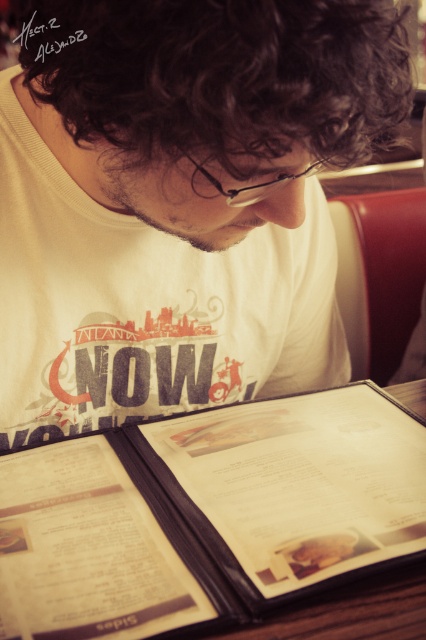
Can you confirm if brown leather menu at lower center is positioned to the left of beige paper menu at lower center?

In fact, brown leather menu at lower center is to the right of beige paper menu at lower center.

Locate an element on the screen. brown leather menu at lower center is located at coordinates (206, 513).

What do you see at coordinates (206, 513) in the screenshot?
I see `brown leather menu at lower center` at bounding box center [206, 513].

This screenshot has height=640, width=426. What are the coordinates of `brown leather menu at lower center` in the screenshot? It's located at (206, 513).

Looking at this image, who is more forward, (282, 196) or (108, 433)?

Point (282, 196) is more forward.

Which is above, white matte t-shirt at center or brown leather menu at lower center?

Positioned higher is white matte t-shirt at center.

Does point (339, 60) come behind point (183, 568)?

No.

Where is `white matte t-shirt at center`? This screenshot has height=640, width=426. white matte t-shirt at center is located at coordinates (x=180, y=196).

The image size is (426, 640). Describe the element at coordinates (206, 513) in the screenshot. I see `brown leather menu at lower center` at that location.

In the scene shown: Between brown leather menu at lower center and clear plastic glasses at center, which one has more height?

brown leather menu at lower center is taller.

Describe the element at coordinates (206, 513) in the screenshot. The image size is (426, 640). I see `brown leather menu at lower center` at that location.

Locate an element on the screen. brown leather menu at lower center is located at coordinates pos(206,513).